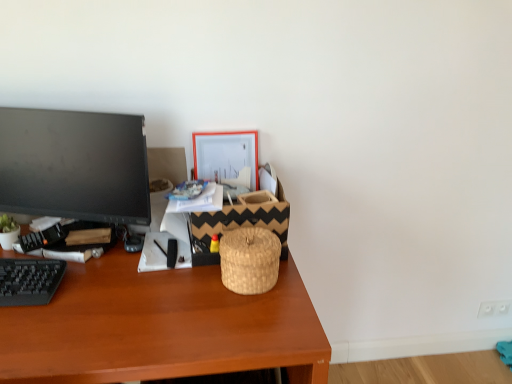
Image resolution: width=512 pixels, height=384 pixels. What are the coordinates of `free location to the right of black plastic keyboard at lower left` in the screenshot? It's located at (81, 308).